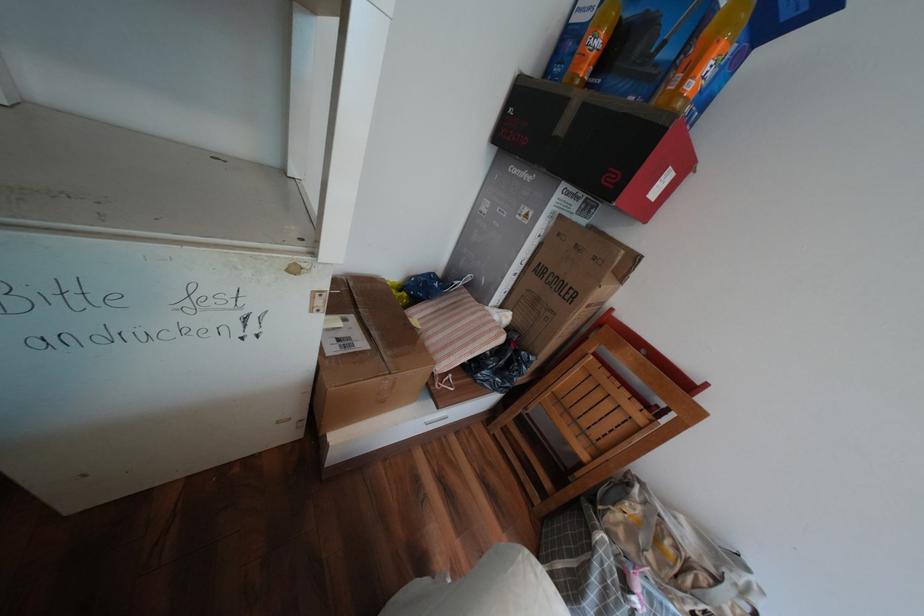
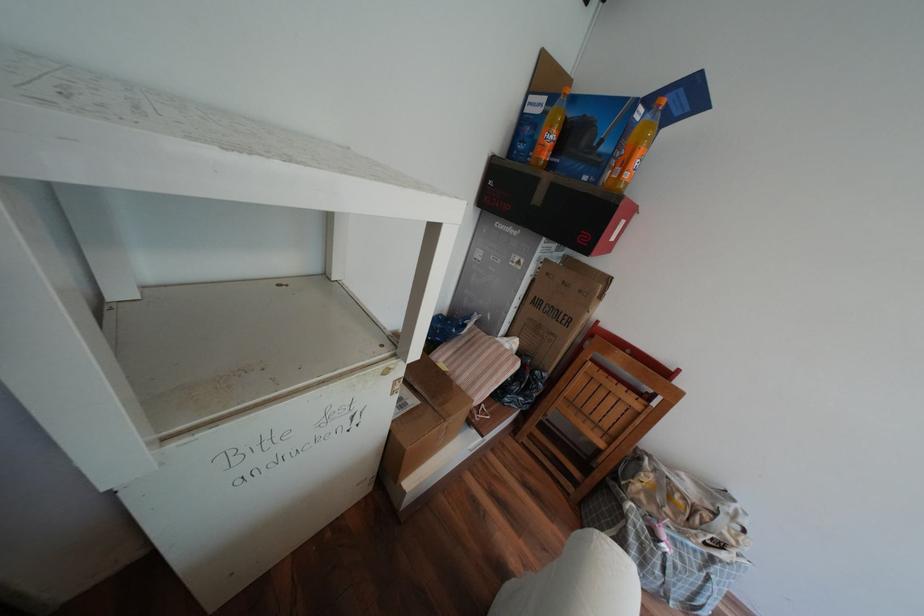
In the second image, find the point that corresponds to point (575, 100) in the first image.

(545, 180)